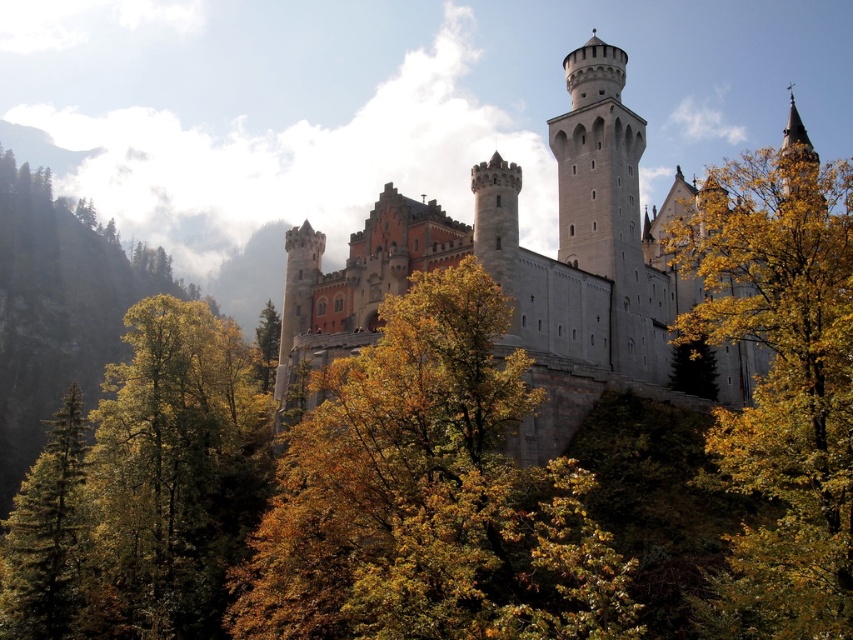
Who is more forward, (618, 112) or (68, 428)?

Point (68, 428) is more forward.

Where is `white stone tower at upper center`? The height and width of the screenshot is (640, 853). white stone tower at upper center is located at coordinates click(x=596, y=164).

Measure the distance between point (x=444, y=468) and camera.

A distance of 43.81 meters exists between point (x=444, y=468) and camera.

Who is shorter, golden leafy tree at center or white stone tower at upper center?

Standing shorter between the two is golden leafy tree at center.

Between point (271, 518) and point (589, 97), which one is positioned in front?

Point (271, 518) is more forward.

The image size is (853, 640). I want to click on golden leafy tree at center, so click(428, 496).

Which of these two, white stone tower at upper center or smooth gray steeple at upper right, stands taller?

white stone tower at upper center is taller.

Based on the photo, is the position of white stone tower at upper center less distant than that of smooth gray steeple at upper right?

Yes, it is in front of smooth gray steeple at upper right.

The width and height of the screenshot is (853, 640). What do you see at coordinates (596, 164) in the screenshot?
I see `white stone tower at upper center` at bounding box center [596, 164].

This screenshot has height=640, width=853. What are the coordinates of `white stone tower at upper center` in the screenshot? It's located at (596, 164).